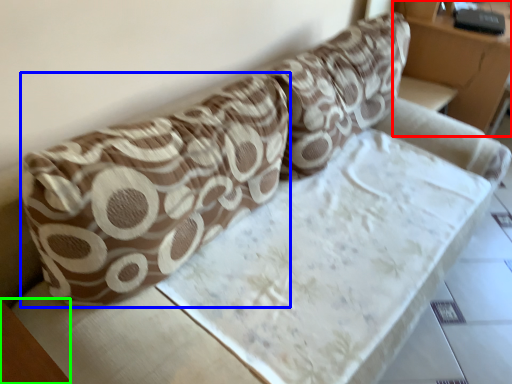
Question: Considering the real-world distances, which object is farthest from furniture (highlighted by a red box)? throw pillow (highlighted by a blue box) or table (highlighted by a green box)?

Choices:
 (A) throw pillow
 (B) table

Answer: (B)